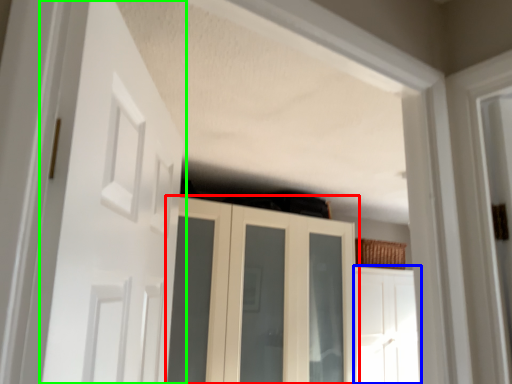
Question: Considering the real-world distances, which object is farthest from cupboard (highlighted by a red box)? door (highlighted by a blue box) or door (highlighted by a green box)?

Choices:
 (A) door
 (B) door

Answer: (B)